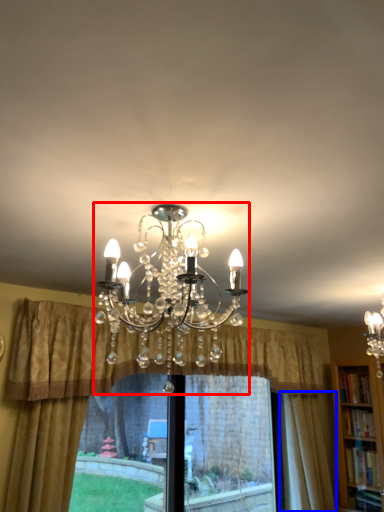
Question: Which of the following is the closest to the observer, lamp (highlighted by a red box) or curtain (highlighted by a blue box)?

Choices:
 (A) lamp
 (B) curtain

Answer: (A)